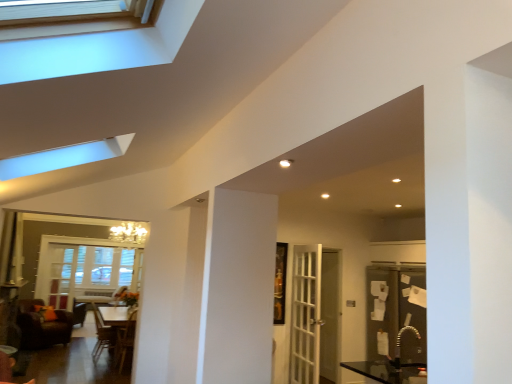
Question: In terms of size, does dark brown leather armchair at center, the first armchair viewed from the left, appear bigger or smaller than brown leather armchair at lower left, which appears as the 2th armchair when viewed from the left?

Choices:
 (A) small
 (B) big

Answer: (B)

Question: From the image's perspective, is dark brown leather armchair at center, the first armchair viewed from the left, positioned above or below brown leather armchair at lower left, which is the first armchair from right to left?

Choices:
 (A) below
 (B) above

Answer: (A)

Question: Which is farther from the gold metallic sink at lower right?

Choices:
 (A) brown leather armchair at lower left, which is the first armchair from right to left
 (B) clear glass screen door at center
 (C) white glass window at lower left, which ranks as the second window in front-to-back order
 (D) white glossy table at center
 (E) clear glass window at upper left, marked as the 2th window in a back-to-front arrangement

Answer: (E)

Question: Estimate the real-world distances between objects in this image. Which object is closer to the gold metallic sink at lower right?

Choices:
 (A) clear glass screen door at center
 (B) white glass window at lower left, the first window positioned from the left
 (C) white glossy table at center
 (D) brown leather armchair at lower left, which is the first armchair from right to left
 (E) white glass door at center

Answer: (A)